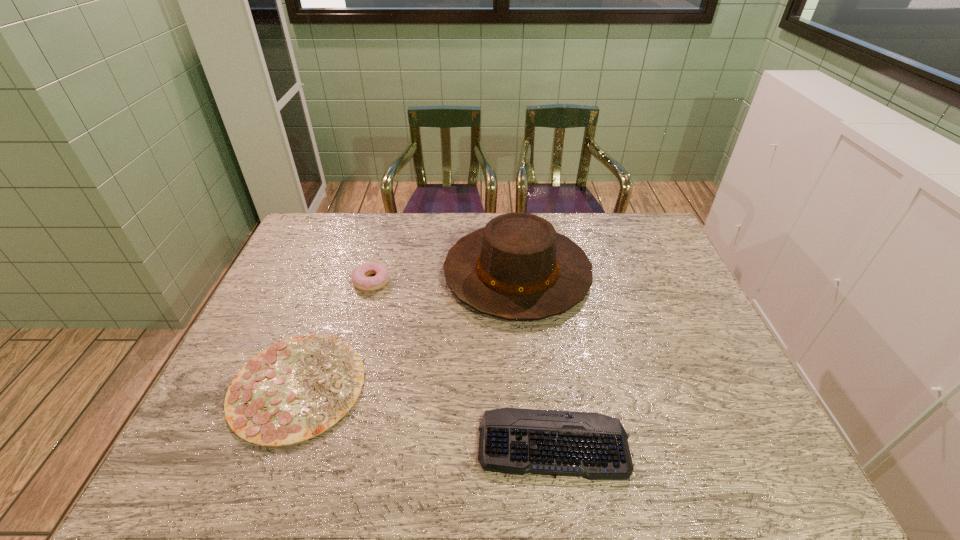
Identify the location of computer keyboard that is at the near edge. (516, 441).

This screenshot has width=960, height=540. In order to click on object present at the left edge in this screenshot , I will do `click(296, 389)`.

You are a GUI agent. You are given a task and a screenshot of the screen. Output one action in this format:
    pyautogui.click(x=<x>, y=<y>)
    Task: Click on the object that is at the near left corner
    The height and width of the screenshot is (540, 960).
    Given the screenshot: What is the action you would take?
    pyautogui.click(x=296, y=389)

Where is `vacant space at the near edge of the desktop`? Image resolution: width=960 pixels, height=540 pixels. vacant space at the near edge of the desktop is located at coordinates (698, 455).

What are the coordinates of `vacant position at the left edge of the desktop` in the screenshot? It's located at click(x=314, y=264).

Find the location of a particular element. Image resolution: width=960 pixels, height=540 pixels. free region at the right edge is located at coordinates (688, 306).

Where is `vacant space at the near left corner`? This screenshot has width=960, height=540. vacant space at the near left corner is located at coordinates (225, 444).

The width and height of the screenshot is (960, 540). In order to click on empty space between the shortest object and the doughnut in this screenshot , I will do [463, 362].

The width and height of the screenshot is (960, 540). Find the location of `free space that is in between the computer keyboard and the doughnut`. free space that is in between the computer keyboard and the doughnut is located at coordinates (463, 362).

The width and height of the screenshot is (960, 540). Find the location of `vacant space that is in between the third tallest object and the doughnut`. vacant space that is in between the third tallest object and the doughnut is located at coordinates (335, 333).